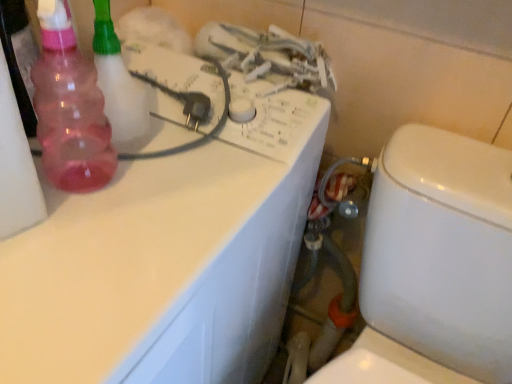
Question: From a real-world perspective, is pink translucent spray bottle at left on top of rubber hose at lower center?

Choices:
 (A) yes
 (B) no

Answer: (A)

Question: Considering the relative positions of pink translucent spray bottle at left and rubber hose at lower center in the image provided, is pink translucent spray bottle at left to the left of rubber hose at lower center from the viewer's perspective?

Choices:
 (A) yes
 (B) no

Answer: (A)

Question: From the image's perspective, does pink translucent spray bottle at left appear higher than rubber hose at lower center?

Choices:
 (A) no
 (B) yes

Answer: (B)

Question: From the image's perspective, is pink translucent spray bottle at left under rubber hose at lower center?

Choices:
 (A) no
 (B) yes

Answer: (A)

Question: Considering the relative sizes of pink translucent spray bottle at left and rubber hose at lower center in the image provided, is pink translucent spray bottle at left thinner than rubber hose at lower center?

Choices:
 (A) yes
 (B) no

Answer: (A)

Question: Does pink translucent spray bottle at left have a greater width compared to rubber hose at lower center?

Choices:
 (A) yes
 (B) no

Answer: (B)

Question: Is white glossy toilet at lower right positioned before white glossy counter top at upper left?

Choices:
 (A) no
 (B) yes

Answer: (B)

Question: Is white glossy toilet at lower right wider than white glossy counter top at upper left?

Choices:
 (A) no
 (B) yes

Answer: (A)

Question: Is white glossy toilet at lower right facing away from white glossy counter top at upper left?

Choices:
 (A) yes
 (B) no

Answer: (B)

Question: Is white glossy toilet at lower right shorter than white glossy counter top at upper left?

Choices:
 (A) no
 (B) yes

Answer: (A)

Question: Is white glossy toilet at lower right outside white glossy counter top at upper left?

Choices:
 (A) no
 (B) yes

Answer: (B)

Question: Can you confirm if white glossy toilet at lower right is positioned to the right of white glossy counter top at upper left?

Choices:
 (A) yes
 (B) no

Answer: (A)

Question: Considering the relative positions of pink translucent bottle at left and white glossy toilet at lower right in the image provided, is pink translucent bottle at left to the left of white glossy toilet at lower right from the viewer's perspective?

Choices:
 (A) no
 (B) yes

Answer: (B)